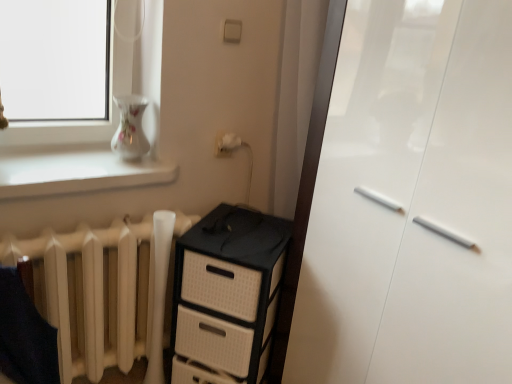
At what (x,y) coordinates should I click in order to perform the action: click on vacant area on top of white glossy vase at upper left (from a real-world perspective). Please return your answer as a coordinate pair (x, y). The width and height of the screenshot is (512, 384). Looking at the image, I should click on (75, 159).